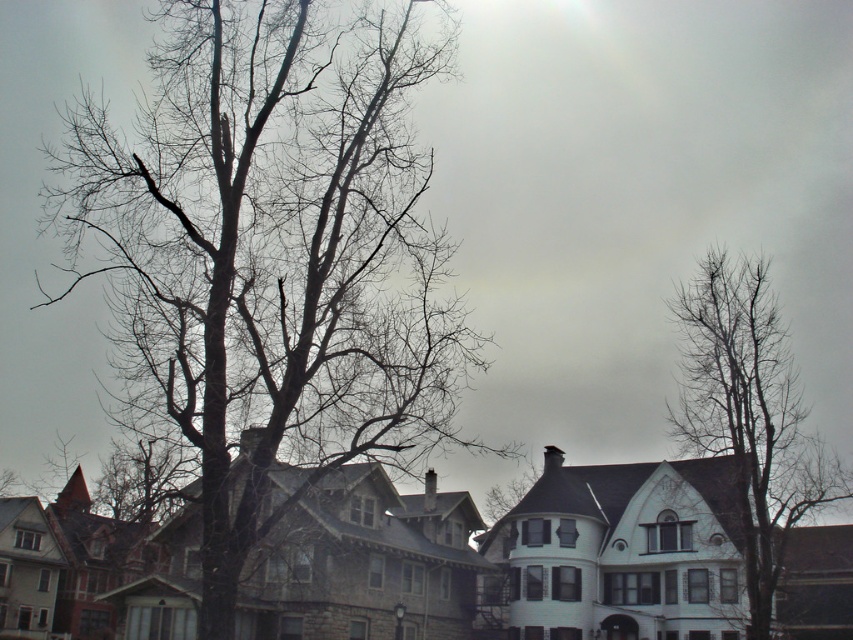
Question: Which point is closer to the camera taking this photo?

Choices:
 (A) (790, 472)
 (B) (368, 433)

Answer: (B)

Question: Is bare branches at left smaller than bare branches at upper right?

Choices:
 (A) no
 (B) yes

Answer: (A)

Question: Does bare branches at left have a greater width compared to bare branches at upper right?

Choices:
 (A) yes
 (B) no

Answer: (A)

Question: Can you confirm if bare branches at left is smaller than bare branches at upper right?

Choices:
 (A) no
 (B) yes

Answer: (A)